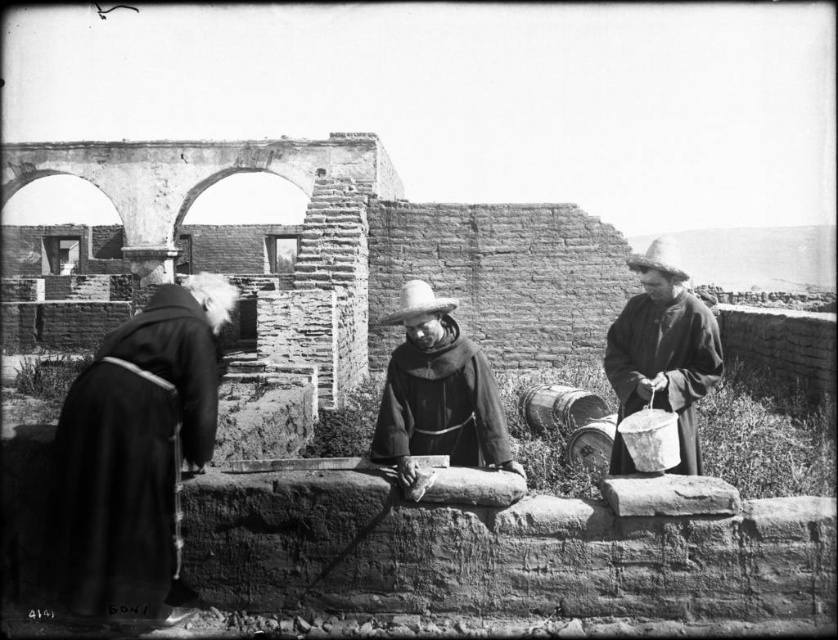
Question: Is dark woolen robe at left below dark brown woolen robe at right?

Choices:
 (A) yes
 (B) no

Answer: (A)

Question: Does smooth brown robe at center lie in front of dark brown woolen robe at right?

Choices:
 (A) yes
 (B) no

Answer: (A)

Question: Which object is closer to the camera taking this photo?

Choices:
 (A) smooth brown robe at center
 (B) dark brown woolen robe at right
 (C) dark woolen robe at left

Answer: (C)

Question: Is smooth brown robe at center positioned before dark brown woolen robe at right?

Choices:
 (A) yes
 (B) no

Answer: (A)

Question: Which object appears closest to the camera in this image?

Choices:
 (A) dark woolen robe at left
 (B) smooth brown robe at center
 (C) dark brown woolen robe at right

Answer: (A)

Question: Which object is positioned closest to the dark woolen robe at left?

Choices:
 (A) smooth brown robe at center
 (B) dark brown woolen robe at right

Answer: (A)